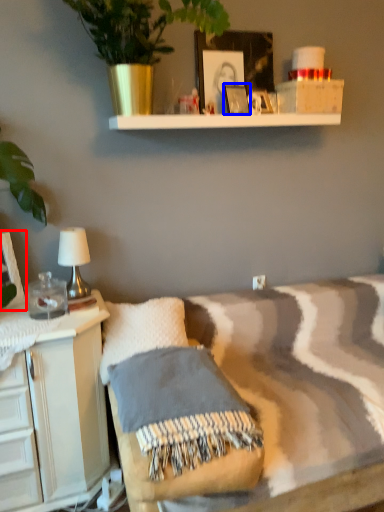
Question: Which of the following is the closest to the observer, picture frame (highlighted by a red box) or picture frame (highlighted by a blue box)?

Choices:
 (A) picture frame
 (B) picture frame

Answer: (A)